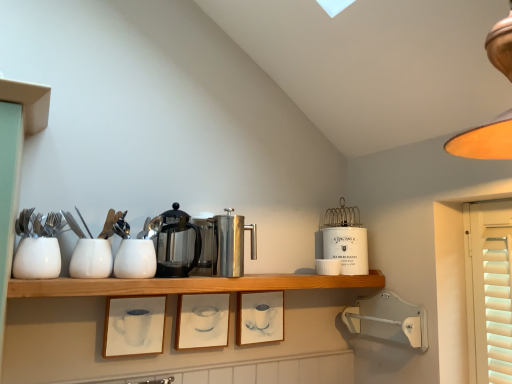
How much space does matte white picture frame at center, positioned as the 3th picture frame in left-to-right order, occupy vertically?

It is 7.14 inches.

Looking at this image, what is the approximate height of matte orange lampshade at upper right?

The height of matte orange lampshade at upper right is 19.37 inches.

What do you see at coordinates (177, 244) in the screenshot? Image resolution: width=512 pixels, height=384 pixels. I see `polished stainless steel coffee pot at center` at bounding box center [177, 244].

Locate an element on the screen. The image size is (512, 384). polished stainless steel coffee pot at center is located at coordinates (177, 244).

The image size is (512, 384). Identify the location of polished stainless steel coffee press at center, the 1th appliance positioned from the front. (230, 244).

From the image's perspective, does white ceramic canister at upper center, marked as the 3th appliance in a left-to-right arrangement, appear lower than white glossy teapot at center, arranged as the 2th tableware when viewed from the right?

Indeed, from the image's perspective, white ceramic canister at upper center, marked as the 3th appliance in a left-to-right arrangement, is shown beneath white glossy teapot at center, arranged as the 2th tableware when viewed from the right.

Who is bigger, white ceramic canister at upper center, marked as the 3th appliance in a left-to-right arrangement, or white glossy teapot at center, the 3th tableware viewed from the left?

white ceramic canister at upper center, marked as the 3th appliance in a left-to-right arrangement.

Does white ceramic canister at upper center, marked as the 3th appliance in a left-to-right arrangement, have a lesser width compared to white glossy teapot at center, arranged as the 2th tableware when viewed from the right?

In fact, white ceramic canister at upper center, marked as the 3th appliance in a left-to-right arrangement, might be wider than white glossy teapot at center, arranged as the 2th tableware when viewed from the right.

Is matte orange lampshade at upper right not close to white matte cup at left, placed as the fourth tableware when sorted from right to left?

matte orange lampshade at upper right is positioned a significant distance from white matte cup at left, placed as the fourth tableware when sorted from right to left.

Can you confirm if matte orange lampshade at upper right is smaller than white matte cup at left, placed as the fourth tableware when sorted from right to left?

No, matte orange lampshade at upper right is not smaller than white matte cup at left, placed as the fourth tableware when sorted from right to left.

In terms of width, does matte orange lampshade at upper right look wider or thinner when compared to white matte cup at left, which is counted as the 4th tableware, starting from the back?

In the image, matte orange lampshade at upper right appears to be wider than white matte cup at left, which is counted as the 4th tableware, starting from the back.

From a real-world perspective, is matte orange lampshade at upper right positioned over white matte cup at left, positioned as the first tableware in front-to-back order, based on gravity?

Yes, from a real-world perspective, matte orange lampshade at upper right is on top of white matte cup at left, positioned as the first tableware in front-to-back order.

Can you confirm if matte white picture frame at lower center, the 3th picture frame in the right-to-left sequence, is shorter than wooden shelf at center?

Incorrect, the height of matte white picture frame at lower center, the 3th picture frame in the right-to-left sequence, does not fall short of that of wooden shelf at center.

Are matte white picture frame at lower center, which is counted as the first picture frame, starting from the left, and wooden shelf at center far apart?

No, matte white picture frame at lower center, which is counted as the first picture frame, starting from the left, is not far from wooden shelf at center.

You are a GUI agent. You are given a task and a screenshot of the screen. Output one action in this format:
    pyautogui.click(x=<x>, y=<y>)
    Task: Click on the shelf above the matte white picture frame at lower center, which is counted as the first picture frame, starting from the left (from a real-world perspective)
    This screenshot has height=384, width=512.
    Given the screenshot: What is the action you would take?
    click(186, 285)

Where is `the 2nd picture frame located beneath the polished stainless steel coffee pot at center (from a real-world perspective)`? This screenshot has height=384, width=512. the 2nd picture frame located beneath the polished stainless steel coffee pot at center (from a real-world perspective) is located at coordinates (134, 325).

Considering the positions of objects polished stainless steel coffee pot at center and matte white picture frame at lower center, the 3th picture frame in the right-to-left sequence, in the image provided, who is more to the left, polished stainless steel coffee pot at center or matte white picture frame at lower center, the 3th picture frame in the right-to-left sequence,?

From the viewer's perspective, matte white picture frame at lower center, the 3th picture frame in the right-to-left sequence, appears more on the left side.

Are polished stainless steel coffee pot at center and matte white picture frame at lower center, which is counted as the first picture frame, starting from the left, beside each other?

polished stainless steel coffee pot at center and matte white picture frame at lower center, which is counted as the first picture frame, starting from the left, are not in contact.

Locate an element on the screen. lamp to the right of white glossy teapot at center, arranged as the 2th tableware when viewed from the right is located at coordinates (484, 140).

In the scene shown: Which of these two, matte orange lampshade at upper right or white glossy teapot at center, which appears as the 3th tableware when viewed from the front, stands shorter?

white glossy teapot at center, which appears as the 3th tableware when viewed from the front, is shorter.

Is matte orange lampshade at upper right positioned behind white glossy teapot at center, which ranks as the 2th tableware in back-to-front order?

No.

From a real-world perspective, is matte white picture frame at lower center, which is counted as the first picture frame, starting from the left, positioned under white matte cup at left, placed as the fourth tableware when sorted from right to left, based on gravity?

Yes, from a real-world perspective, matte white picture frame at lower center, which is counted as the first picture frame, starting from the left, is under white matte cup at left, placed as the fourth tableware when sorted from right to left.

Between matte white picture frame at lower center, which is counted as the first picture frame, starting from the left, and white matte cup at left, which is counted as the 4th tableware, starting from the back, which one is positioned in front?

white matte cup at left, which is counted as the 4th tableware, starting from the back.

Does matte white picture frame at lower center, the 3th picture frame in the right-to-left sequence, turn towards white matte cup at left, which ranks as the first tableware in left-to-right order?

No, matte white picture frame at lower center, the 3th picture frame in the right-to-left sequence, does not turn towards white matte cup at left, which ranks as the first tableware in left-to-right order.

From the image's perspective, between matte white picture frame at lower center, the 3th picture frame in the right-to-left sequence, and white glossy cup at center, the third tableware when ordered from right to left, who is located below?

matte white picture frame at lower center, the 3th picture frame in the right-to-left sequence, is shown below in the image.

Based on the photo, is matte white picture frame at lower center, the 3th picture frame in the right-to-left sequence, facing away from white glossy cup at center, which is counted as the second tableware, starting from the front?

No, white glossy cup at center, which is counted as the second tableware, starting from the front, is not at the back of matte white picture frame at lower center, the 3th picture frame in the right-to-left sequence.

Which is in front, point (154, 304) or point (106, 256)?

The point (106, 256) is in front.

Would you consider matte white picture frame at lower center, the 3th picture frame in the right-to-left sequence, to be distant from white glossy cup at center, which is the 2th tableware in left-to-right order?

They are positioned close to each other.

I want to click on the 3rd appliance counting from the right of the white glossy teapot at center, which appears as the 3th tableware when viewed from the front, so click(343, 239).

Find the location of a particular element. The image size is (512, 384). the 4th tableware to the left when counting from the matte orange lampshade at upper right is located at coordinates pyautogui.click(x=37, y=258).

Based on their spatial positions, is white ceramic cup at upper right, placed as the 1th tableware when sorted from right to left, or satin silver carafe at center, the 1th appliance in the left-to-right sequence, closer to matte white picture frame at center, positioned as the 3th picture frame in left-to-right order?

Among the two, satin silver carafe at center, the 1th appliance in the left-to-right sequence, is located nearer to matte white picture frame at center, positioned as the 3th picture frame in left-to-right order.

Estimate the real-world distances between objects in this image. Which object is further from white matte cup at left, which is counted as the 4th tableware, starting from the back, matte orange lampshade at upper right or white glossy cup at center, marked as the third tableware in a back-to-front arrangement?

Based on the image, matte orange lampshade at upper right appears to be further to white matte cup at left, which is counted as the 4th tableware, starting from the back.

Looking at the image, which one is located further to polished stainless steel coffee press at center, the 1th appliance positioned from the front, matte white picture frame at lower center, the 3th picture frame in the right-to-left sequence, or wooden shelf at center?

matte white picture frame at lower center, the 3th picture frame in the right-to-left sequence, is further to polished stainless steel coffee press at center, the 1th appliance positioned from the front.

From the image, which object appears to be nearer to matte orange lampshade at upper right, white glossy cup at center, marked as the third tableware in a back-to-front arrangement, or matte white picture frame at lower center, the 3th picture frame in the right-to-left sequence?

white glossy cup at center, marked as the third tableware in a back-to-front arrangement.

Looking at the image, which one is located further to wooden shelf at center, white matte cup at left, placed as the fourth tableware when sorted from right to left, or matte white picture frame at center, which is the 2th picture frame from right to left?

white matte cup at left, placed as the fourth tableware when sorted from right to left, is positioned further to the anchor wooden shelf at center.

Looking at this image, estimate the real-world distances between objects in this image. Which object is closer to satin silver carafe at center, which is the 2th appliance from back to front, white matte cup at left, which ranks as the first tableware in left-to-right order, or wooden shelf at center?

wooden shelf at center is closer to satin silver carafe at center, which is the 2th appliance from back to front.

Estimate the real-world distances between objects in this image. Which object is further from white ceramic cup at upper right, the 4th tableware when ordered from left to right, matte white picture frame at center, positioned as the 1th picture frame in right-to-left order, or matte white picture frame at center, which is counted as the 2th picture frame, starting from the left?

matte white picture frame at center, which is counted as the 2th picture frame, starting from the left.

Based on their spatial positions, is white glossy cup at center, which is counted as the second tableware, starting from the front, or polished stainless steel coffee press at center, the third appliance viewed from the back, further from white glossy teapot at center, which appears as the 3th tableware when viewed from the front?

polished stainless steel coffee press at center, the third appliance viewed from the back, lies further to white glossy teapot at center, which appears as the 3th tableware when viewed from the front, than the other object.

The height and width of the screenshot is (384, 512). I want to click on coffeepot between wooden shelf at center and satin silver carafe at center, which is the 2th appliance from back to front, from front to back, so click(177, 244).

Identify the location of appliance located between white matte cup at left, which is counted as the 4th tableware, starting from the back, and polished stainless steel coffee press at center, the third appliance viewed from the back, in the left-right direction. (204, 245).

The image size is (512, 384). What are the coordinates of `coffeepot located between white glossy cup at center, which is the 2th tableware in left-to-right order, and matte orange lampshade at upper right in the left-right direction` in the screenshot? It's located at (177, 244).

Locate an element on the screen. picture frame positioned between wooden shelf at center and matte white picture frame at center, which is the 2th picture frame from right to left, from near to far is located at coordinates (134, 325).